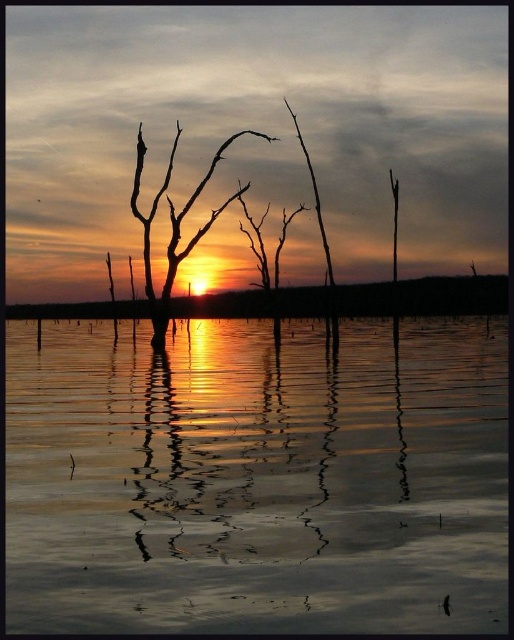
You are an artist trying to paint the sunset scene. You notice two areas of water in the image. One is labeled as smooth reflective water at center and the other as smooth water at center. Which one is located to the left?

The smooth reflective water at center is positioned on the left side of smooth water at center.

You are a photographer wanting to capture the reflection of the silhouette bare tree at center in the smooth water at center. Given that your camera can focus on objects up to 30 meters away, will you be able to clearly capture the reflection?

The distance between the smooth water at center and the silhouette bare tree at center is 31.26 meters. Since your camera can only focus up to 30 meters, you won t be able to clearly capture the reflection.